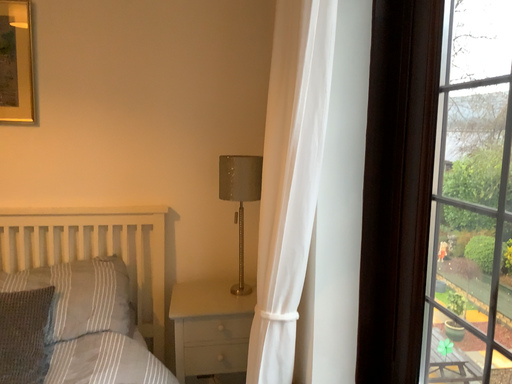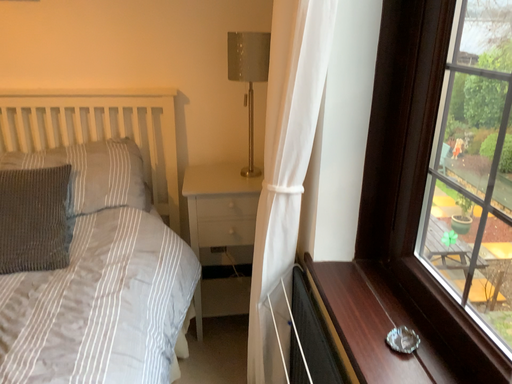
Question: Which way did the camera rotate in the video?

Choices:
 (A) rotated upward
 (B) rotated downward

Answer: (B)